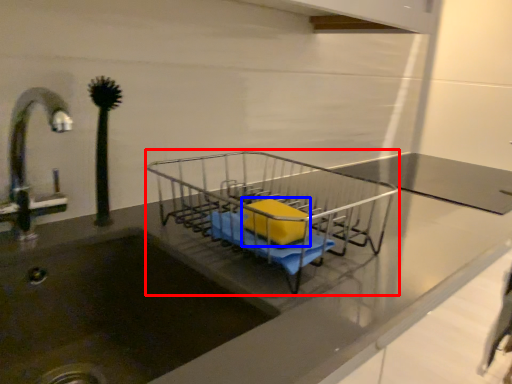
Question: Which object is further to the camera taking this photo, trolley (highlighted by a red box) or material (highlighted by a blue box)?

Choices:
 (A) trolley
 (B) material

Answer: (B)